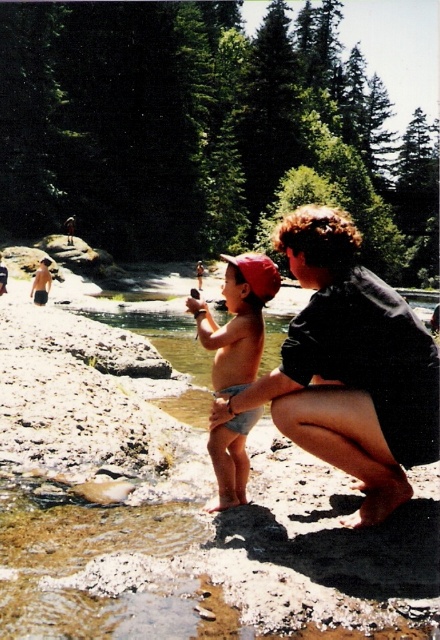
Based on the photo, you are a photographer trying to capture a candid shot of the tan skin baby at center and the dark gray fabric at center. To ensure both are in focus, you need to know which object is taller. Can you tell me which one is taller?

The dark gray fabric at center has a greater height compared to the tan skin baby at center, so the dark gray fabric at center is taller.

You are a photographer trying to capture a candid shot of the tan skin baby at center and the dark gray fabric at center. Since you want to focus on the baby, which object should you avoid placing in the foreground of your photo?

The dark gray fabric at center is above the tan skin baby at center, so to avoid placing it in the foreground, you should focus on the tan skin baby at center as the dark gray fabric is positioned above it and might not be in the immediate foreground unless adjusted.